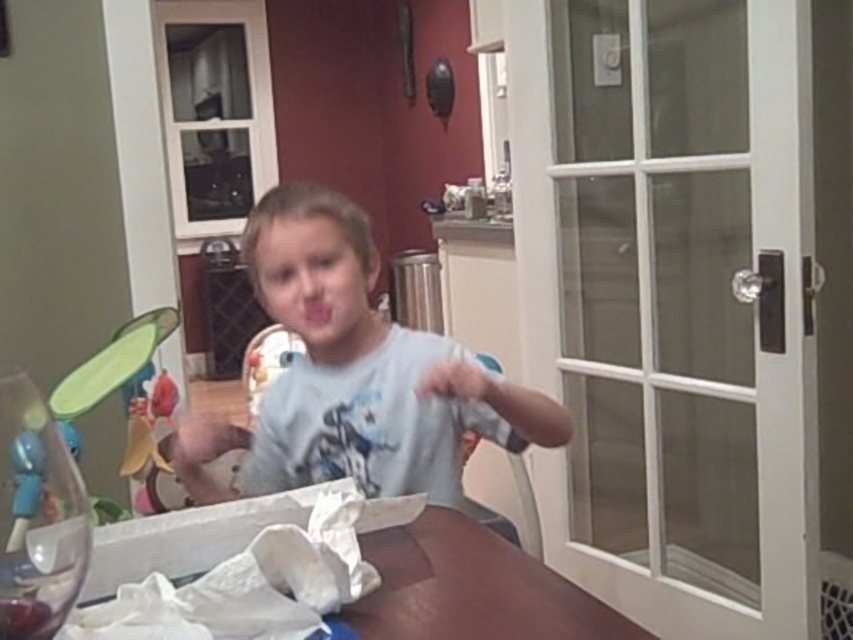
You are a parent trying to clean up after your child. You see the white cotton shirt at center and the transparent plastic wine glass at lower left on the table. Which item should you pick up first if you want to clear the larger object first?

The white cotton shirt at center is bigger than the transparent plastic wine glass at lower left, so you should pick up the white cotton shirt at center first.

You are a photographer trying to capture a candid shot of the child. You notice the white cotton shirt at center and the transparent plastic wine glass at lower left in the frame. Which object is closer to your camera lens?

The white cotton shirt at center is closer to the camera lens because it is further to the viewer than the transparent plastic wine glass at lower left.